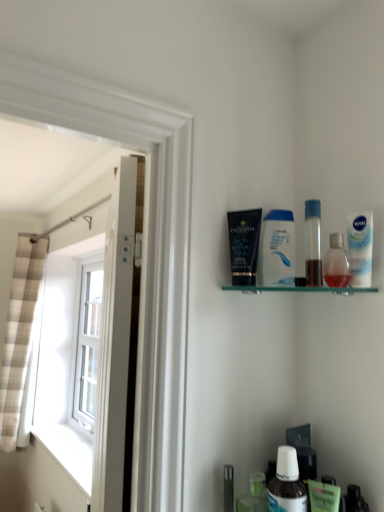
What is the approximate width of translucent plastic bottle at lower center, the third toiletry viewed from the top?

It is 2.31 inches.

Describe the element at coordinates (115, 344) in the screenshot. I see `white glossy door at left` at that location.

The image size is (384, 512). Identify the location of green matte mouthwash at lower right, which is the second mouthwash in right-to-left order. (323, 496).

What is the approximate width of white glossy lotion at center?

2.87 centimeters.

I want to click on translucent plastic bottle at lower center, which is the second toiletry from right to left, so click(x=254, y=495).

How distant is transparent plastic bottle at upper right, positioned as the second mouthwash in left-to-right order, from white plastic mouthwash at lower center, the second mouthwash from the bottom?

A distance of 38.10 centimeters exists between transparent plastic bottle at upper right, positioned as the second mouthwash in left-to-right order, and white plastic mouthwash at lower center, the second mouthwash from the bottom.

Does point (319, 200) come farther from viewer compared to point (287, 487)?

Yes, it is.

Which object is further away from the camera, transparent plastic bottle at upper right, positioned as the 3th mouthwash in right-to-left order, or white plastic mouthwash at lower center, placed as the 1th mouthwash when sorted from left to right?

Positioned behind is transparent plastic bottle at upper right, positioned as the 3th mouthwash in right-to-left order.

Is transparent plastic bottle at upper right, which is the fourth mouthwash from bottom to top, smaller than white plastic mouthwash at lower center, arranged as the 3th mouthwash when viewed from the top?

Yes.

Between transparent plastic bottle at upper right, which is the fourth mouthwash from bottom to top, and white matte nivea mouthwash at upper right, placed as the 4th mouthwash when sorted from left to right, which one is positioned in front?

transparent plastic bottle at upper right, which is the fourth mouthwash from bottom to top.

Measure the distance from transparent plastic bottle at upper right, positioned as the 3th mouthwash in right-to-left order, to white matte nivea mouthwash at upper right, the 2th mouthwash in the top-to-bottom sequence.

transparent plastic bottle at upper right, positioned as the 3th mouthwash in right-to-left order, and white matte nivea mouthwash at upper right, the 2th mouthwash in the top-to-bottom sequence, are 3.75 inches apart from each other.

What's the angular difference between transparent plastic bottle at upper right, positioned as the 3th mouthwash in right-to-left order, and white matte nivea mouthwash at upper right, acting as the third mouthwash starting from the bottom,'s facing directions?

There is a 0.0365-degree angle between the facing directions of transparent plastic bottle at upper right, positioned as the 3th mouthwash in right-to-left order, and white matte nivea mouthwash at upper right, acting as the third mouthwash starting from the bottom.

Is transparent plastic bottle at upper right, which is the fourth mouthwash from bottom to top, shorter than white matte nivea mouthwash at upper right, placed as the 4th mouthwash when sorted from left to right?

No, transparent plastic bottle at upper right, which is the fourth mouthwash from bottom to top, is not shorter than white matte nivea mouthwash at upper right, placed as the 4th mouthwash when sorted from left to right.

Find the location of a particular element. the 1st toiletry positioned above the white glossy door at left (from the image's perspective) is located at coordinates (336, 263).

What's the angular difference between transparent plastic spray bottle at upper right, the 2th toiletry positioned from the bottom, and white glossy door at left's facing directions?

15.9 degrees separate the facing orientations of transparent plastic spray bottle at upper right, the 2th toiletry positioned from the bottom, and white glossy door at left.

Who is more distant, transparent plastic spray bottle at upper right, the second toiletry in the top-to-bottom sequence, or white glossy door at left?

transparent plastic spray bottle at upper right, the second toiletry in the top-to-bottom sequence, is further from the camera.

Is point (329, 260) closer or farther from the camera than point (104, 447)?

Point (329, 260) is closer to the camera than point (104, 447).

From a real-world perspective, between matte black tube at upper center, acting as the 1th toiletry starting from the top, and plaid fabric curtain at left, who is vertically lower?

plaid fabric curtain at left, from a real-world perspective.

Which object is further away from the camera, matte black tube at upper center, which appears as the 3th toiletry when ordered from the bottom, or plaid fabric curtain at left?

plaid fabric curtain at left is further from the camera.

Choose the correct answer: Is matte black tube at upper center, acting as the 1th toiletry starting from the top, inside plaid fabric curtain at left or outside it?

matte black tube at upper center, acting as the 1th toiletry starting from the top, is spatially situated outside plaid fabric curtain at left.

Who is smaller, matte black tube at upper center, acting as the 1th toiletry starting from the top, or plaid fabric curtain at left?

matte black tube at upper center, acting as the 1th toiletry starting from the top.

Consider the image. From the image's perspective, is transparent plastic spray bottle at upper right, the second toiletry in the top-to-bottom sequence, located above or below plaid fabric curtain at left?

From the image's perspective, transparent plastic spray bottle at upper right, the second toiletry in the top-to-bottom sequence, appears above plaid fabric curtain at left.

Does transparent plastic spray bottle at upper right, the 1th toiletry viewed from the right, have a lesser width compared to plaid fabric curtain at left?

Correct, the width of transparent plastic spray bottle at upper right, the 1th toiletry viewed from the right, is less than that of plaid fabric curtain at left.

What's the angular difference between transparent plastic spray bottle at upper right, the 1th toiletry viewed from the right, and plaid fabric curtain at left's facing directions?

The angular difference between transparent plastic spray bottle at upper right, the 1th toiletry viewed from the right, and plaid fabric curtain at left is 1.26 degrees.

From the picture: Is transparent plastic spray bottle at upper right, the 1th toiletry viewed from the right, situated inside transparent plastic bottle at upper right, which is counted as the first mouthwash, starting from the top, or outside?

transparent plastic spray bottle at upper right, the 1th toiletry viewed from the right, is outside transparent plastic bottle at upper right, which is counted as the first mouthwash, starting from the top.

From the image's perspective, which is above, transparent plastic spray bottle at upper right, the third toiletry when ordered from left to right, or transparent plastic bottle at upper right, positioned as the 3th mouthwash in right-to-left order?

transparent plastic bottle at upper right, positioned as the 3th mouthwash in right-to-left order, appears higher in the image.

Is transparent plastic spray bottle at upper right, the 1th toiletry viewed from the right, positioned far away from transparent plastic bottle at upper right, which is counted as the first mouthwash, starting from the top?

No, transparent plastic spray bottle at upper right, the 1th toiletry viewed from the right, is not far from transparent plastic bottle at upper right, which is counted as the first mouthwash, starting from the top.

Does transparent plastic spray bottle at upper right, the 2th toiletry positioned from the bottom, have a greater height compared to transparent plastic bottle at upper right, positioned as the second mouthwash in left-to-right order?

No.

Based on the photo, is white glossy door at left directly adjacent to white matte nivea mouthwash at upper right, the 2th mouthwash in the top-to-bottom sequence?

No.

Between point (94, 499) and point (368, 267), which one is positioned behind?

The point (94, 499) is farther.

Can you confirm if white glossy door at left is thinner than white matte nivea mouthwash at upper right, the 2th mouthwash in the top-to-bottom sequence?

No.

From a real-world perspective, is white glossy door at left on top of white matte nivea mouthwash at upper right, which appears as the first mouthwash when viewed from the right?

No, from a real-world perspective, white glossy door at left is not over white matte nivea mouthwash at upper right, which appears as the first mouthwash when viewed from the right

Where is `the 2nd mouthwash below the transparent plastic bottle at upper right, which is the fourth mouthwash from bottom to top (from the image's perspective)`? the 2nd mouthwash below the transparent plastic bottle at upper right, which is the fourth mouthwash from bottom to top (from the image's perspective) is located at coordinates (287, 484).

The width and height of the screenshot is (384, 512). Identify the location of the 2nd mouthwash to the left of the white matte nivea mouthwash at upper right, acting as the third mouthwash starting from the bottom, starting your count from the anchor. (313, 243).

From the image, which object appears to be farther from plaid fabric curtain at left, white glossy lotion at center or transparent plastic spray bottle at upper right, the 1th toiletry viewed from the right?

transparent plastic spray bottle at upper right, the 1th toiletry viewed from the right, lies further to plaid fabric curtain at left than the other object.

Considering their positions, is translucent plastic bottle at lower center, which is the second toiletry from right to left, positioned closer to white glossy lotion at center than matte black tube at upper center, which is counted as the 3th toiletry, starting from the right?

Among the two, matte black tube at upper center, which is counted as the 3th toiletry, starting from the right, is located nearer to white glossy lotion at center.

Estimate the real-world distances between objects in this image. Which object is closer to white plastic mouthwash at lower center, the second mouthwash from the bottom, transparent plastic bottle at upper right, which is the fourth mouthwash from bottom to top, or transparent plastic spray bottle at upper right, the 1th toiletry viewed from the right?

Based on the image, transparent plastic spray bottle at upper right, the 1th toiletry viewed from the right, appears to be nearer to white plastic mouthwash at lower center, the second mouthwash from the bottom.

Looking at the image, which one is located closer to white plastic mouthwash at lower center, the second mouthwash from the bottom, white glossy lotion at center or plaid fabric curtain at left?

Based on the image, white glossy lotion at center appears to be nearer to white plastic mouthwash at lower center, the second mouthwash from the bottom.

Looking at the image, which one is located further to plaid fabric curtain at left, white glossy lotion at center or matte black tube at upper center, which is counted as the 3th toiletry, starting from the right?

matte black tube at upper center, which is counted as the 3th toiletry, starting from the right, is positioned further to the anchor plaid fabric curtain at left.

Which object lies nearer to the anchor point translucent plastic bottle at lower center, acting as the 1th toiletry starting from the bottom, matte black tube at upper center, which is counted as the 3th toiletry, starting from the right, or green matte mouthwash at lower right, which is the second mouthwash in right-to-left order?

green matte mouthwash at lower right, which is the second mouthwash in right-to-left order, is positioned closer to the anchor translucent plastic bottle at lower center, acting as the 1th toiletry starting from the bottom.

In the scene shown: Looking at the image, which one is located further to white plastic mouthwash at lower center, arranged as the 3th mouthwash when viewed from the top, green matte mouthwash at lower right, the fourth mouthwash viewed from the top, or transparent plastic spray bottle at upper right, the third toiletry when ordered from left to right?

transparent plastic spray bottle at upper right, the third toiletry when ordered from left to right, is further to white plastic mouthwash at lower center, arranged as the 3th mouthwash when viewed from the top.

When comparing their distances from white glossy door at left, does plaid fabric curtain at left or white matte nivea mouthwash at upper right, the 2th mouthwash in the top-to-bottom sequence, seem further?

plaid fabric curtain at left is further to white glossy door at left.

The image size is (384, 512). What are the coordinates of `product between transparent plastic bottle at upper right, which is counted as the first mouthwash, starting from the top, and green matte mouthwash at lower right, the fourth mouthwash viewed from the top, vertically` in the screenshot? It's located at (277, 249).

Where is `mouthwash between matte black tube at upper center, which is counted as the 3th toiletry, starting from the right, and white plastic mouthwash at lower center, the fourth mouthwash in the right-to-left sequence, from top to bottom`? The image size is (384, 512). mouthwash between matte black tube at upper center, which is counted as the 3th toiletry, starting from the right, and white plastic mouthwash at lower center, the fourth mouthwash in the right-to-left sequence, from top to bottom is located at coordinates point(360,248).

This screenshot has width=384, height=512. Identify the location of shelf between white glossy door at left and green matte mouthwash at lower right, which ranks as the third mouthwash in left-to-right order, in the horizontal direction. (300, 289).

Identify the location of toiletry between white glossy lotion at center and white plastic mouthwash at lower center, the fourth mouthwash in the right-to-left sequence, in the up-down direction. (336, 263).